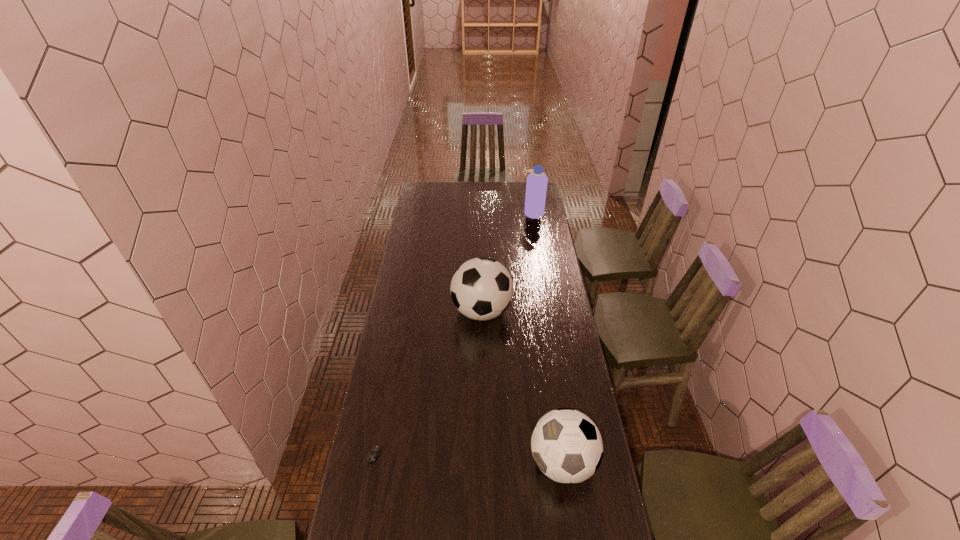
Identify the location of the second closest object to the computer mouse. This screenshot has height=540, width=960. (481, 288).

Find the location of a particular element. Image resolution: width=960 pixels, height=540 pixels. vacant space that satisfies the following two spatial constraints: 1. on the back side of the leftmost object; 2. on the left side of the farthest object is located at coordinates (420, 213).

Where is `free spot that satisfies the following two spatial constraints: 1. on the front side of the farthest object; 2. on the main logo of the shorter soccer ball`? free spot that satisfies the following two spatial constraints: 1. on the front side of the farthest object; 2. on the main logo of the shorter soccer ball is located at coordinates (575, 462).

In order to click on vacant point that satisfies the following two spatial constraints: 1. on the back side of the farthest object; 2. on the right side of the computer mouse in this screenshot , I will do `click(420, 213)`.